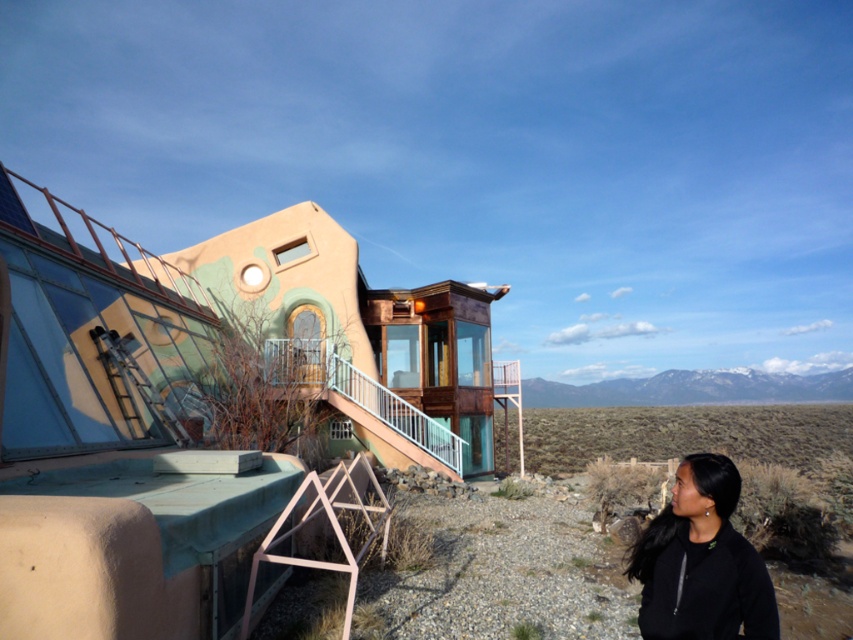
You are standing in front of the architectural structure and want to walk from the desert gravel at lower center to the black matte jacket at lower right. Which direction should you move relative to your current position?

You should move away from the viewer because the desert gravel at lower center is closer to you than the black matte jacket at lower right, so moving away would take you towards the jacket.

You are standing in front of the desert building and want to determine the relative positions of two points marked on the structure. The first point is located at coordinates point (503, 548), and the second point is at point (682, 540). Which of these points is closer to you?

Answer: Point (503, 548) is closer to you because it is further to the viewer than point (682, 540).

You are standing at the entrance of the building and want to walk to the point marked as point (498, 570). What type of terrain will you be walking on?

The point (498, 570) is on desert gravel at lower center, so you will be walking on desert gravel.